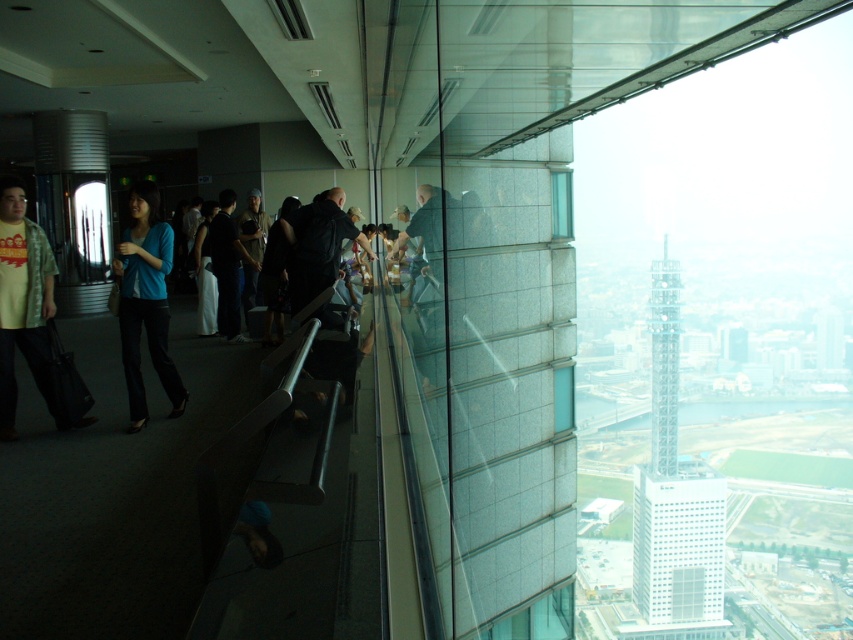
Question: Does white glass tower at upper right have a smaller size compared to transparent glass tower at right?

Choices:
 (A) no
 (B) yes

Answer: (A)

Question: Is white glass building at center further to camera compared to dark blue jacket at center?

Choices:
 (A) yes
 (B) no

Answer: (A)

Question: Which object is farther from the camera taking this photo?

Choices:
 (A) transparent glass tower at right
 (B) metallic gray escalator at center

Answer: (A)

Question: Estimate the real-world distances between objects in this image. Which object is farther from the white glass building at center?

Choices:
 (A) dark blue jeans at center
 (B) dark blue jacket at center
 (C) matte yellow shirt at left

Answer: (C)

Question: Which object is closer to the camera taking this photo?

Choices:
 (A) white glass tower at upper right
 (B) clear glass window at upper right

Answer: (B)

Question: Is dark blue jeans at center below clear glass window at upper right?

Choices:
 (A) no
 (B) yes

Answer: (B)